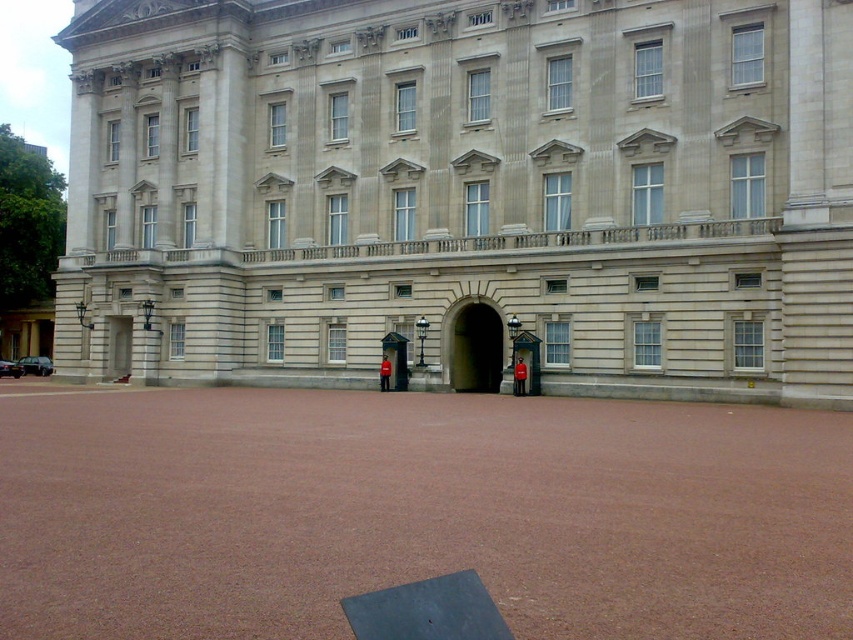
Looking at this image, does light gray stone building at center have a larger size compared to red uniformed guard at center?

Yes.

Between light gray stone building at center and red uniformed guard at center, which one appears on the left side from the viewer's perspective?

Positioned to the left is light gray stone building at center.

What do you see at coordinates (466, 188) in the screenshot? I see `light gray stone building at center` at bounding box center [466, 188].

Identify the location of light gray stone building at center. The width and height of the screenshot is (853, 640). (466, 188).

Who is more distant from viewer, [784,339] or [474,381]?

Point [474,381]

Who is taller, light gray stone building at center or smooth stone archway at center?

With more height is light gray stone building at center.

In the scene shown: Measure the distance between light gray stone building at center and camera.

29.79 meters

Locate an element on the screen. The height and width of the screenshot is (640, 853). light gray stone building at center is located at coordinates (466, 188).

Based on the photo, between smooth stone door at left and red uniformed guard at center, which one appears on the left side from the viewer's perspective?

From the viewer's perspective, smooth stone door at left appears more on the left side.

At what (x,y) coordinates should I click in order to perform the action: click on smooth stone door at left. Please return your answer as a coordinate pair (x, y). The height and width of the screenshot is (640, 853). Looking at the image, I should click on (119, 346).

What are the coordinates of `smooth stone door at left` in the screenshot? It's located at (119, 346).